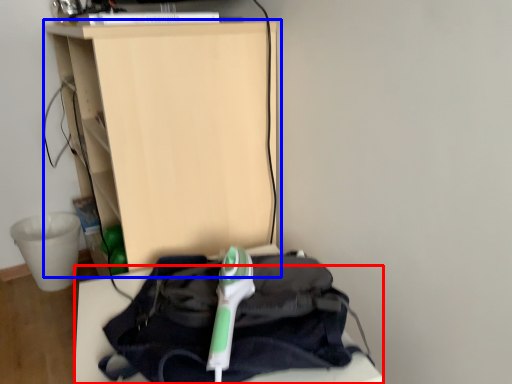
Question: Among these objects, which one is farthest to the camera, furniture (highlighted by a red box) or furniture (highlighted by a blue box)?

Choices:
 (A) furniture
 (B) furniture

Answer: (B)